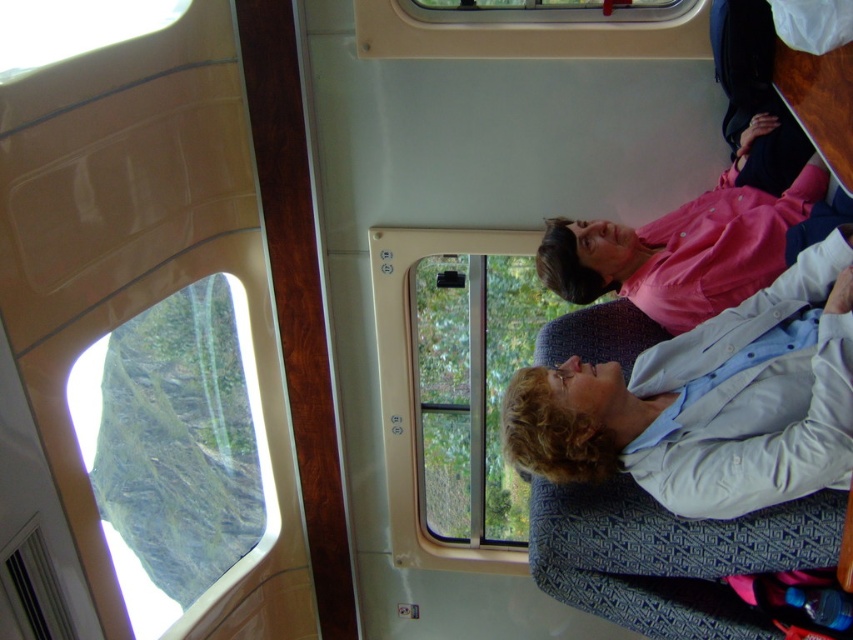
You are a passenger in a train carriage and want to look outside through both windows. The transparent glass window at center and the transparent plastic window at upper center are both available. If you stand between them, how far apart are the two windows?

The transparent glass window at center is 1.69 meters from transparent plastic window at upper center, so the distance between them is 1.69 meters.

Looking at this image, you are a passenger on a train and you want to look outside. Which window, the transparent glass window at center or the transparent plastic window at upper center, allows you to see a wider view of the landscape?

The transparent glass window at center has a larger size compared to the transparent plastic window at upper center, so it allows you to see a wider view of the landscape.

You are standing inside the train carriage and want to look outside through the transparent glass window at center. Where should you stand to see the window clearly?

The transparent glass window at center is located at coordinates point (473, 388), so you should stand near that point to see the window clearly.